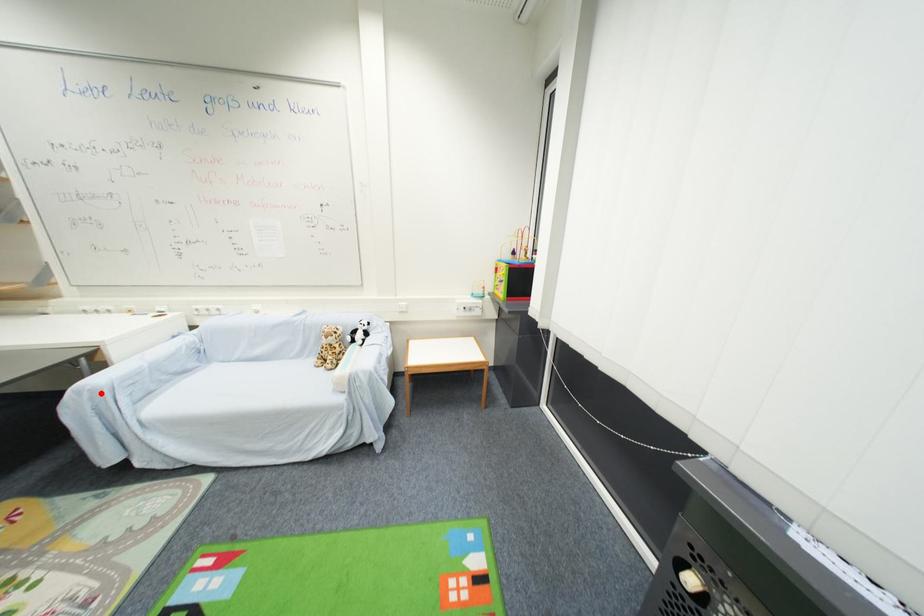
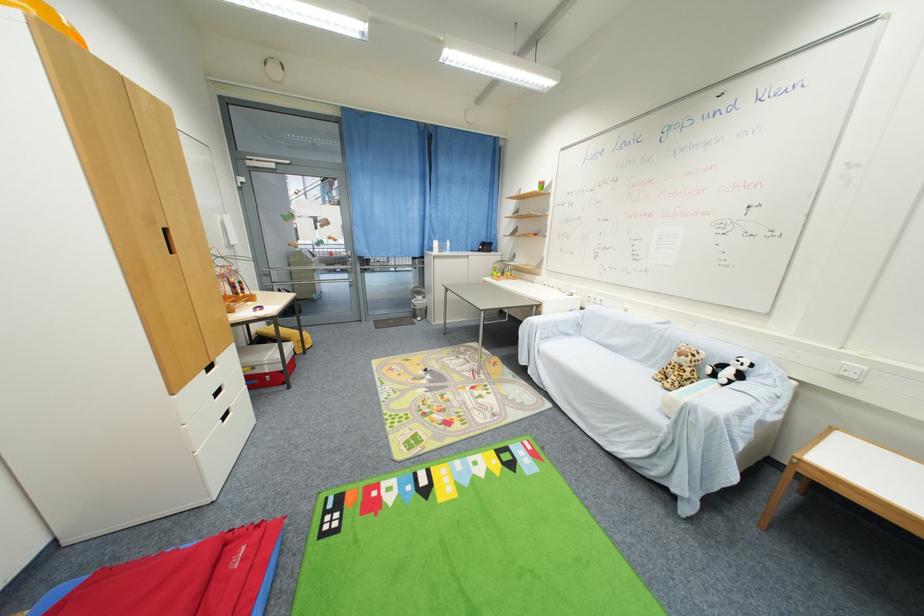
Question: I am providing you with two images of the same scene from different viewpoints. A red point is shown in image1. For the corresponding object point in image2, is it positioned nearer or farther from the camera?

Choices:
 (A) Nearer
 (B) Farther

Answer: (A)